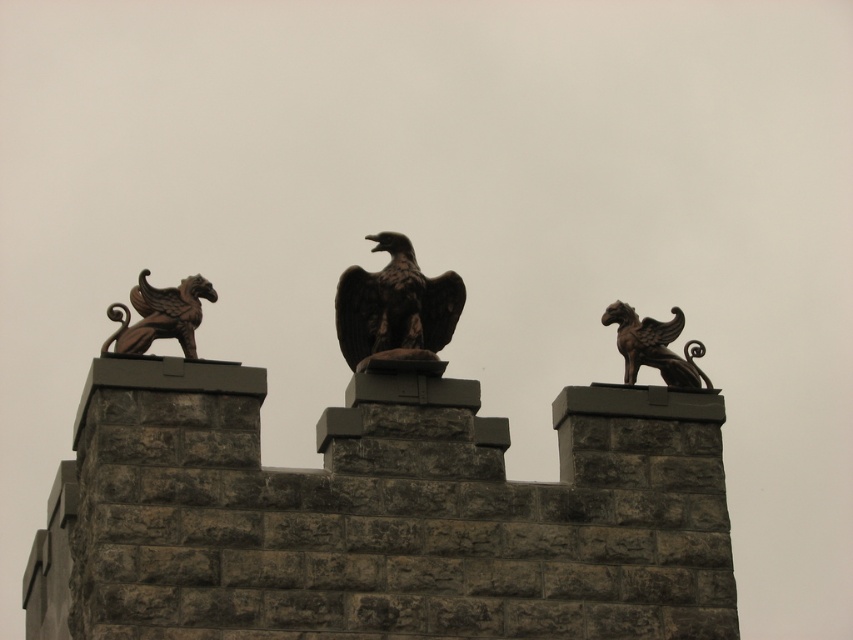
Can you confirm if bronze gargoyle at left is wider than bronze gryphon at right?

Indeed, bronze gargoyle at left has a greater width compared to bronze gryphon at right.

Where is `bronze gargoyle at left`? The image size is (853, 640). bronze gargoyle at left is located at coordinates (160, 316).

Is dark brown stone eagle at center bigger than bronze gryphon at right?

Yes, dark brown stone eagle at center is bigger than bronze gryphon at right.

Which is in front, point (461, 280) or point (671, 353)?

Point (461, 280)

Image resolution: width=853 pixels, height=640 pixels. I want to click on dark brown stone eagle at center, so pos(393,305).

Is dark brown stone eagle at center bigger than bronze gargoyle at left?

No.

Does point (344, 276) lie in front of point (132, 342)?

No, (344, 276) is further to viewer.

At what (x,y) coordinates should I click in order to perform the action: click on dark brown stone eagle at center. Please return your answer as a coordinate pair (x, y). Looking at the image, I should click on (393, 305).

Where is `dark brown stone eagle at center`? dark brown stone eagle at center is located at coordinates (393, 305).